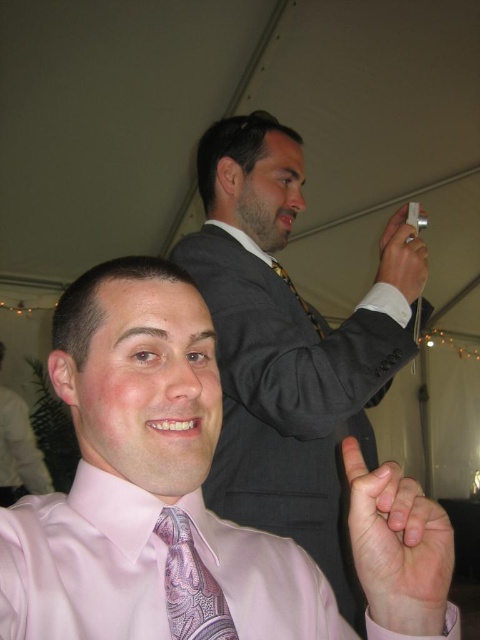
You are a photographer at a wedding reception. You need to ensure that both the matte gray suit at upper center and the patterned silk tie at upper center are visible in your photo. Given their positions, which one might you need to adjust your camera angle to include fully?

The matte gray suit at upper center is taller than the patterned silk tie at upper center. Therefore, you might need to adjust your camera angle to include the taller matte gray suit at upper center fully, as it could be more likely to be partially obscured depending on the current framing.

You are at a wedding reception and see two points in the image. The first point is at coordinates point (x=369, y=380) and the second is at point (x=397, y=220). Which point is closer to you?

Point (x=369, y=380) is closer to the viewer than point (x=397, y=220).

You are a photographer at a wedding reception and need to adjust the focus of your camera. You want to ensure that both the matte gray suit at upper center and the patterned silk tie at upper center are clearly visible. Given their sizes, which one should you prioritize focusing on and why?

The matte gray suit at upper center is larger in size than the patterned silk tie at upper center, so you should prioritize focusing on the matte gray suit at upper center because larger objects generally require more precise focus to maintain clarity across their entire surface.